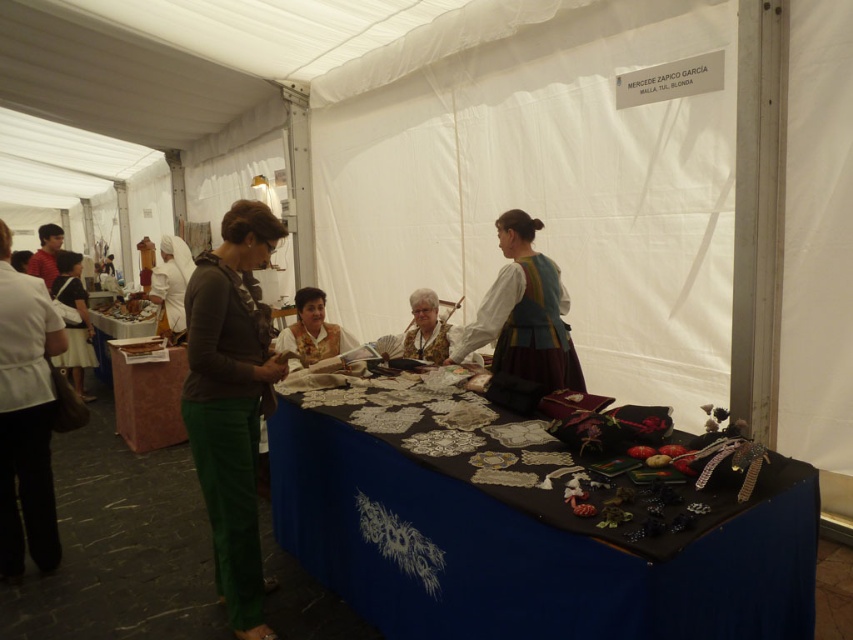
Question: Which of the following is the closest to the observer?

Choices:
 (A) (316, 356)
 (B) (419, 481)
 (C) (160, 266)

Answer: (B)

Question: Which of the following is the farthest from the observer?

Choices:
 (A) (76, 285)
 (B) (413, 328)
 (C) (134, 387)
 (D) (497, 333)

Answer: (A)

Question: Is marble table at center above matte black dress at lower left?

Choices:
 (A) yes
 (B) no

Answer: (B)

Question: Based on their relative distances, which object is nearer to the black fabric table at center?

Choices:
 (A) marble table at center
 (B) matte black dress at lower left
 (C) white silk headscarf at upper left

Answer: (A)

Question: Is black fabric table at center to the left of green fabric pants at left from the viewer's perspective?

Choices:
 (A) no
 (B) yes

Answer: (A)

Question: Does black fabric table at center appear on the right side of white silk headscarf at upper left?

Choices:
 (A) yes
 (B) no

Answer: (A)